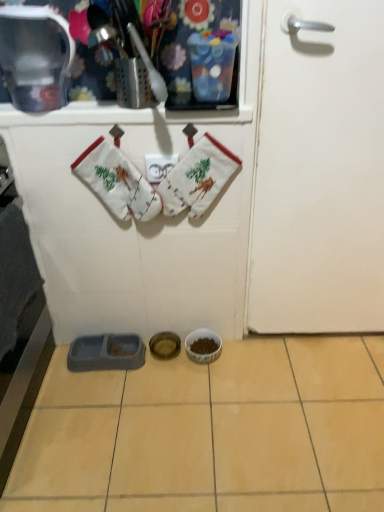
The height and width of the screenshot is (512, 384). I want to click on free spot above yellow ceramic tile at center (from a real-world perspective), so click(204, 412).